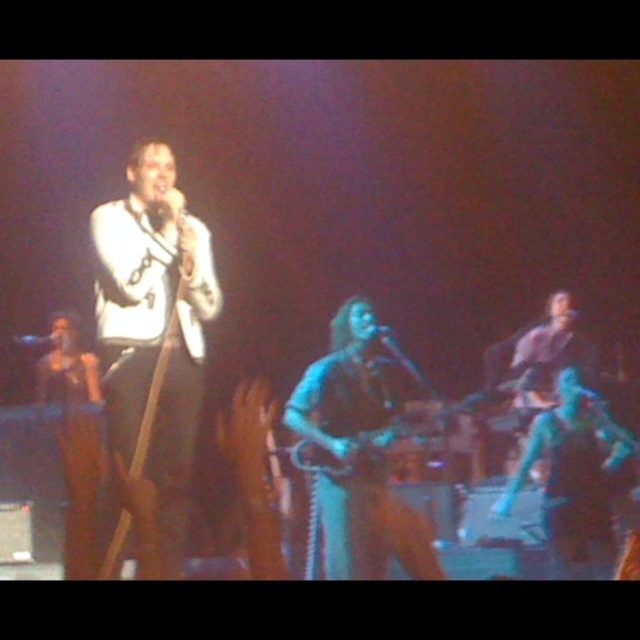
You are an audience member sitting in the front row. You notice two performers on stage. The first performer is wearing a blue leather jacket at center, and the second performer is wearing blue fabric pants at right. Which performer is closer to you?

The blue leather jacket at center is closer to you because it is in front of the blue fabric pants at right.

You are a stagehand who needs to place a 0.5 meters wide equipment between the male performer in white jacket and the blue fabric pants at right. Is there enough space between them?

The blue fabric pants at right is at point (573, 474). The male performer in white jacket is at an unknown position. Without knowing the exact distance between them, it is impossible to determine if there is enough space for the 0.5 meters wide equipment.

You are an audience member sitting in the front row of the concert. You notice two blue items on stage. The first is the blue leather jacket at center and the second is the blue fabric pants at right. Which of these blue items is positioned lower in the image?

The blue leather jacket at center is positioned lower than the blue fabric pants at right in the image.